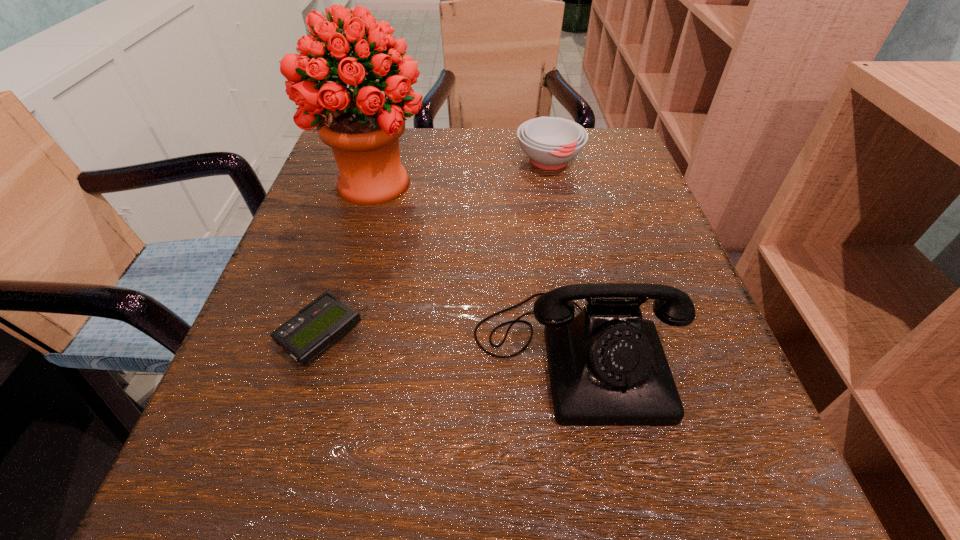
Identify the location of bouquet that is at the left edge. pos(362,127).

Locate an element on the screen. The height and width of the screenshot is (540, 960). beeper located in the left edge section of the desktop is located at coordinates (317, 326).

Identify the location of telephone located at the right edge. (607, 367).

At what (x,y) coordinates should I click in order to perform the action: click on soup bowl that is at the right edge. Please return your answer as a coordinate pair (x, y). This screenshot has height=540, width=960. Looking at the image, I should click on (550, 142).

Image resolution: width=960 pixels, height=540 pixels. Identify the location of object at the far left corner. (362, 127).

Where is `object situated at the far right corner`? object situated at the far right corner is located at coordinates (550, 142).

You are a GUI agent. You are given a task and a screenshot of the screen. Output one action in this format:
    pyautogui.click(x=<x>, y=<y>)
    Task: Click on the vacant area at the far edge of the desktop
    
    Given the screenshot: What is the action you would take?
    pyautogui.click(x=516, y=148)

At what (x,y) coordinates should I click in order to perform the action: click on free space at the left edge. Please return your answer as a coordinate pair (x, y). Looking at the image, I should click on (253, 443).

The height and width of the screenshot is (540, 960). In the image, there is a desktop. Find the location of `vacant space at the right edge`. vacant space at the right edge is located at coordinates (723, 434).

The image size is (960, 540). In order to click on vacant space at the far left corner of the desktop in this screenshot , I will do `click(315, 180)`.